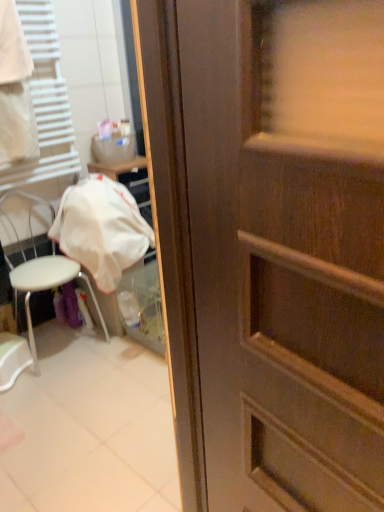
Question: Is white fabric at left wider or thinner than white fabric at left?

Choices:
 (A) thin
 (B) wide

Answer: (B)

Question: Which is correct: white fabric at left is inside white fabric at left, or outside of it?

Choices:
 (A) inside
 (B) outside

Answer: (B)

Question: Based on their relative distances, which object is farther from the white fabric at left?

Choices:
 (A) white fabric at left
 (B) white plastic chair at left

Answer: (A)

Question: Estimate the real-world distances between objects in this image. Which object is closer to the white fabric at left?

Choices:
 (A) white fabric at left
 (B) white plastic chair at left

Answer: (A)